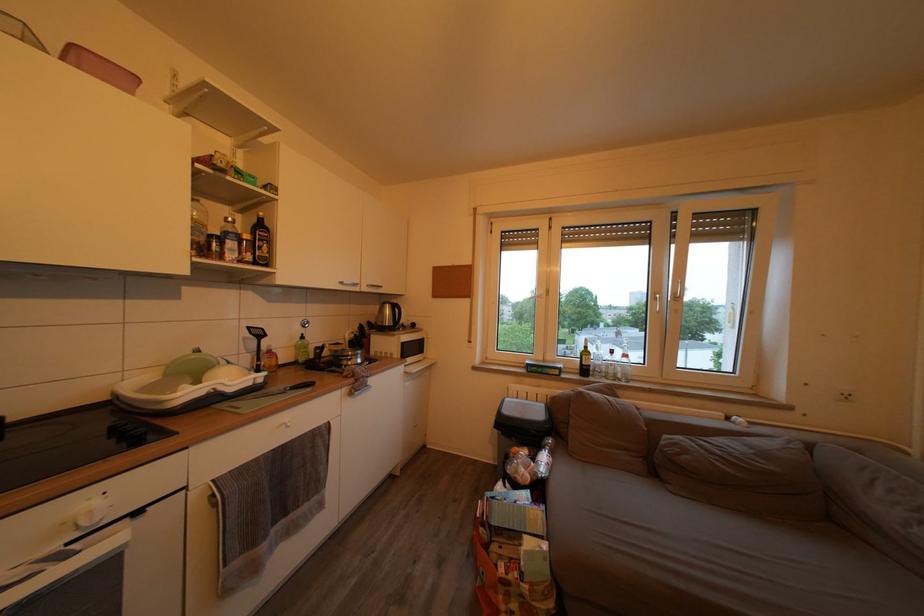
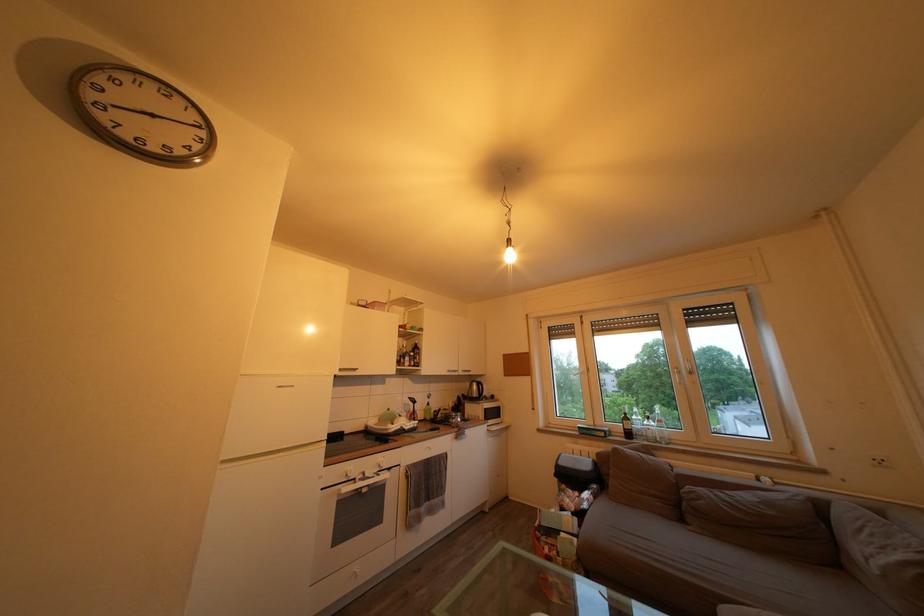
Question: The images are taken continuously from a first-person perspective. In which direction are you moving?

Choices:
 (A) Left
 (B) Right
 (C) Forward
 (D) Backward

Answer: (D)